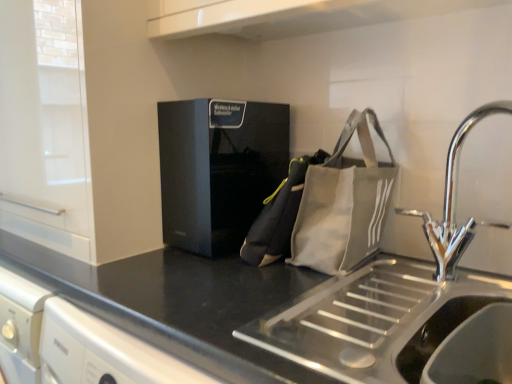
Question: From a real-world perspective, is canvas messenger bag at center above or below chrome metallic tap at right?

Choices:
 (A) below
 (B) above

Answer: (A)

Question: Is canvas messenger bag at center spatially inside chrome metallic tap at right, or outside of it?

Choices:
 (A) outside
 (B) inside

Answer: (A)

Question: Based on their relative distances, which object is nearer to the canvas messenger bag at center?

Choices:
 (A) black matte cabinet at upper left
 (B) black matte speaker at center
 (C) stainless steel sink at lower right
 (D) gray canvas tote bag at right
 (E) black matte countertop at center

Answer: (D)

Question: Considering the real-world distances, which object is farthest from the black matte speaker at center?

Choices:
 (A) chrome metallic tap at right
 (B) black matte cabinet at upper left
 (C) black matte countertop at center
 (D) stainless steel sink at lower right
 (E) gray canvas tote bag at right

Answer: (D)